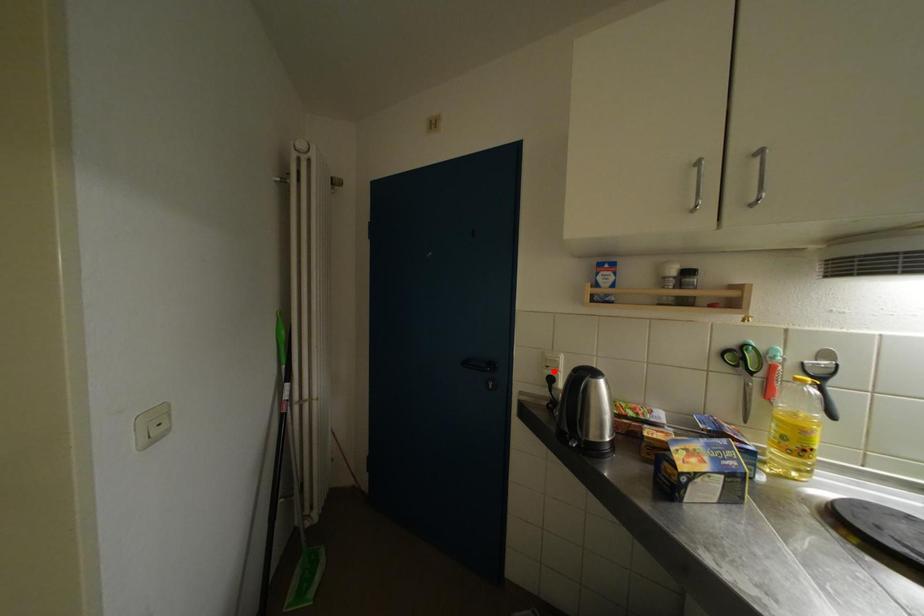
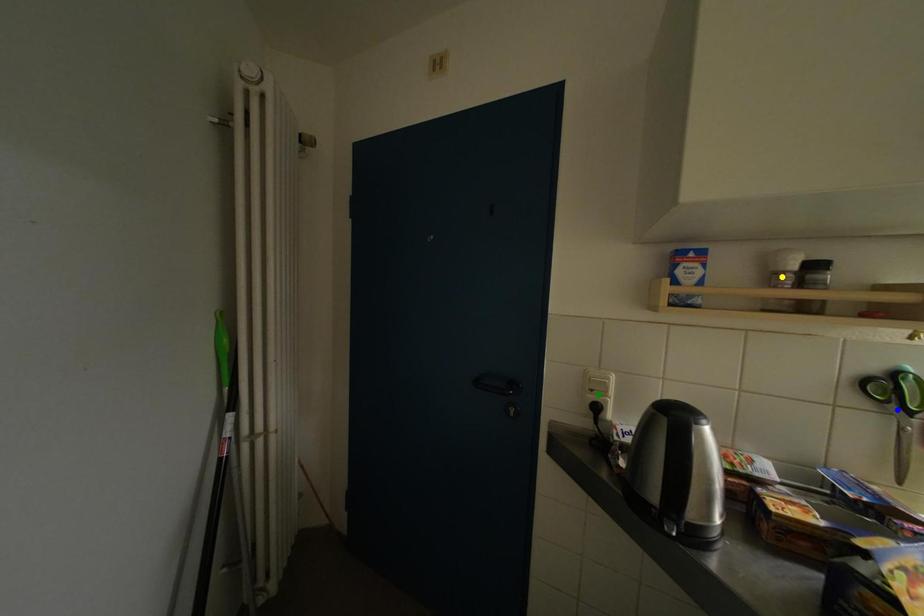
Question: I am providing you with two images of the same scene from different viewpoints. A red point is marked on the first image. You are given multiple points on the second image. Which spot in image 2 lines up with the point in image 1?

Choices:
 (A) yellow point
 (B) green point
 (C) blue point

Answer: (B)